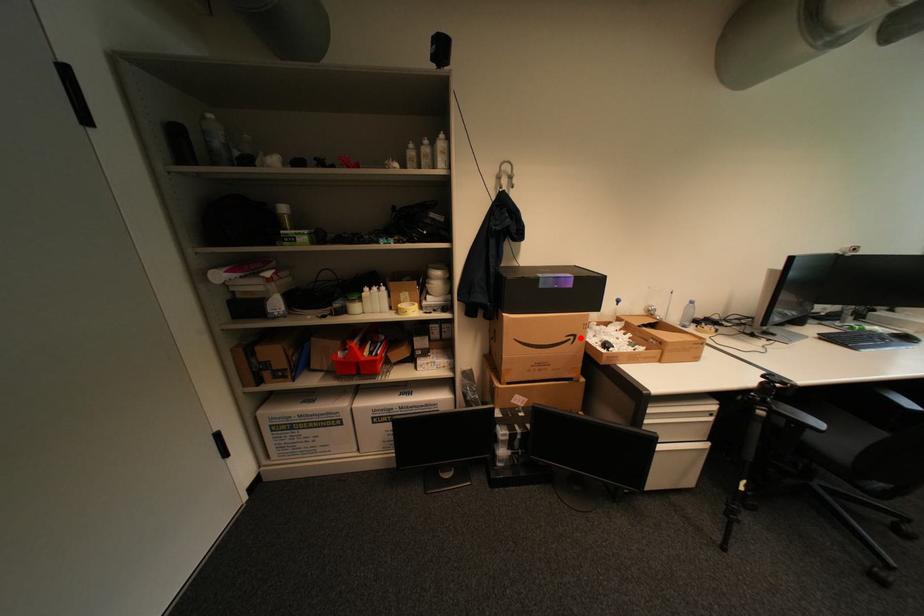
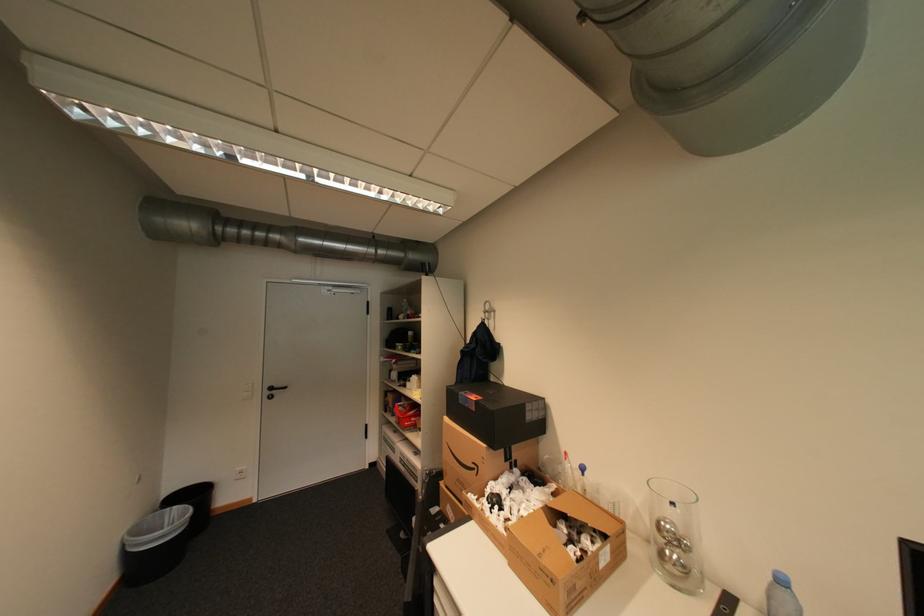
Locate, in the second image, the point that corresponds to the highlighted location in the first image.

(484, 468)